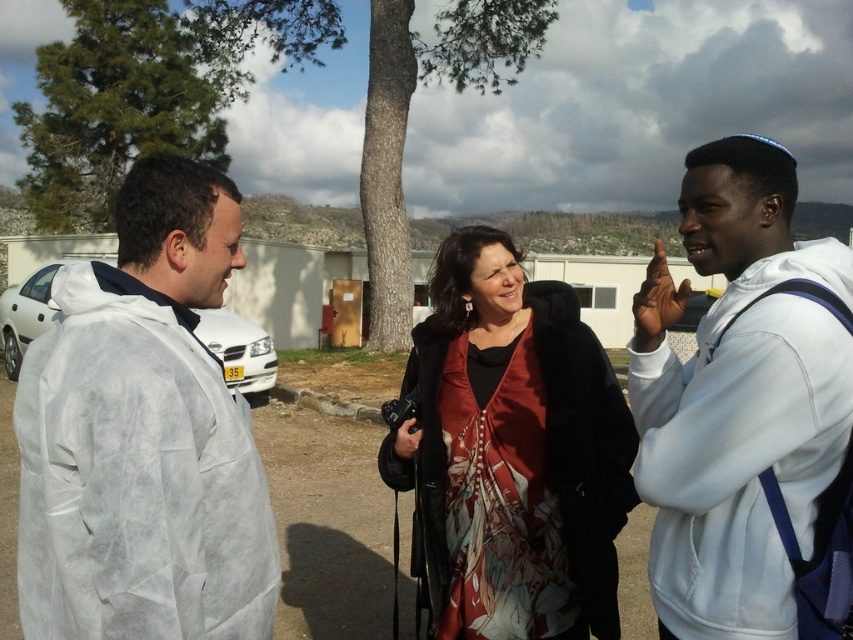
Is point (126, 460) positioned before point (682, 554)?

That is True.

Between white paper coat at left and white fleece jacket at right, which one has more height?

With more height is white fleece jacket at right.

Is point (61, 276) closer to camera compared to point (767, 230)?

Yes, point (61, 276) is closer to viewer.

I want to click on white paper coat at left, so click(143, 435).

Is white paper coat at left thinner than white matte car at left?

Indeed, white paper coat at left has a lesser width compared to white matte car at left.

Does white paper coat at left appear on the right side of white matte car at left?

Indeed, white paper coat at left is positioned on the right side of white matte car at left.

Locate an element on the screen. The width and height of the screenshot is (853, 640). white paper coat at left is located at coordinates (143, 435).

Find the location of a particular element. white paper coat at left is located at coordinates (143, 435).

Who is positioned more to the right, satin dress at center or white matte car at left?

From the viewer's perspective, satin dress at center appears more on the right side.

Does point (448, 509) lie in front of point (16, 333)?

Yes.

Who is more forward, (x=599, y=572) or (x=15, y=314)?

Point (x=599, y=572) is more forward.

Where is `satin dress at center`? Image resolution: width=853 pixels, height=640 pixels. satin dress at center is located at coordinates (512, 451).